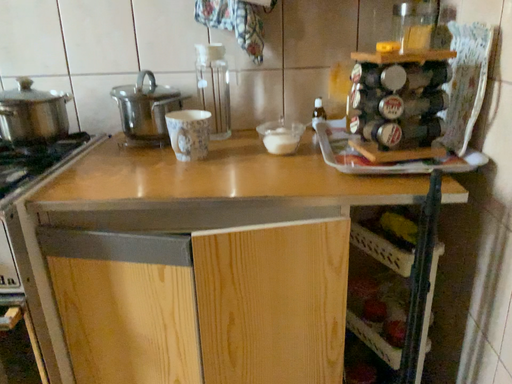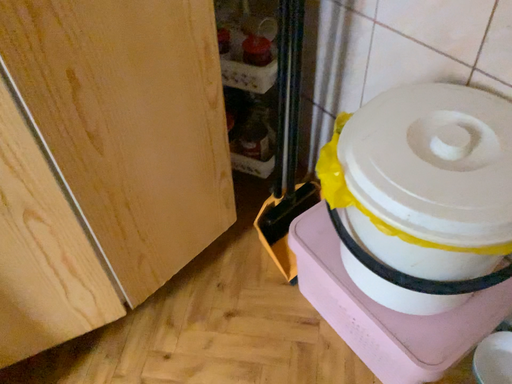
Question: How did the camera likely rotate when shooting the video?

Choices:
 (A) rotated left
 (B) rotated right

Answer: (B)